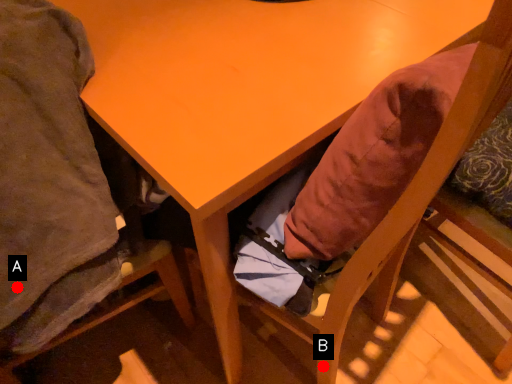
Question: Two points are circled on the image, labeled by A and B beside each circle. Which point is farther from the camera taking this photo?

Choices:
 (A) A is further
 (B) B is further

Answer: (B)